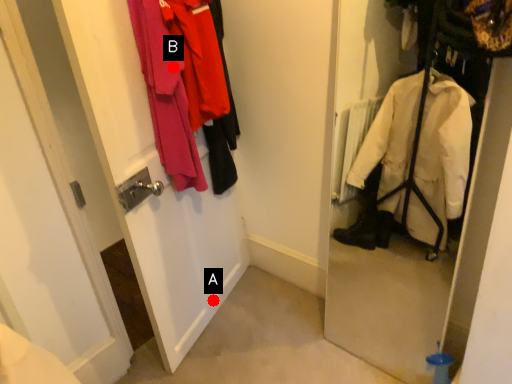
Question: Two points are circled on the image, labeled by A and B beside each circle. Which point is farther to the camera?

Choices:
 (A) A is further
 (B) B is further

Answer: (A)